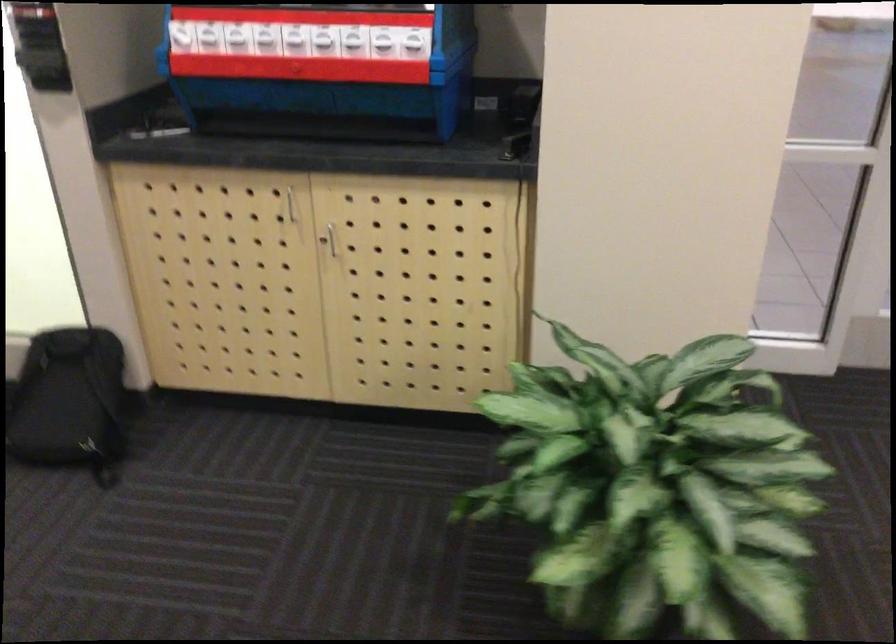
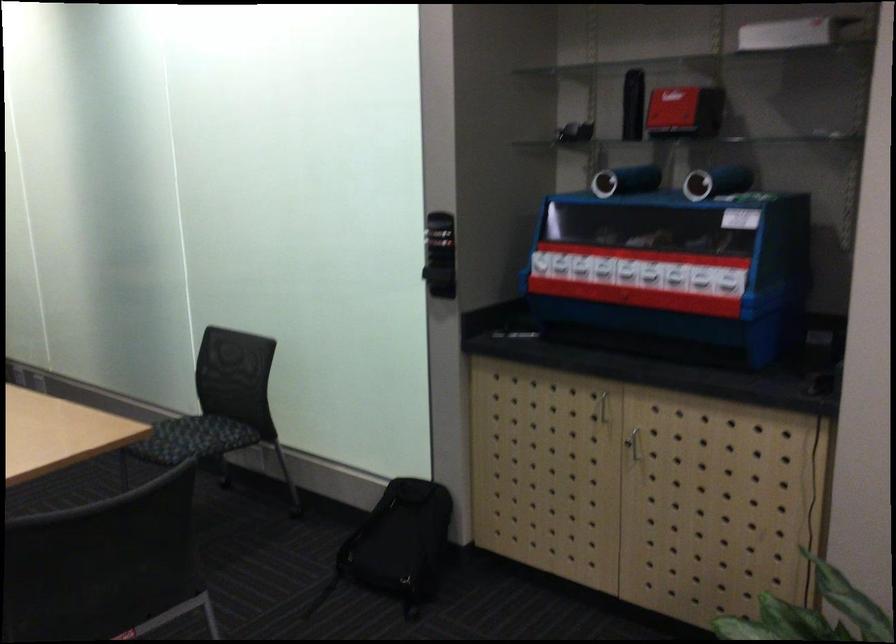
Where in the second image is the point corresponding to pixel 73 409 from the first image?

(398, 545)